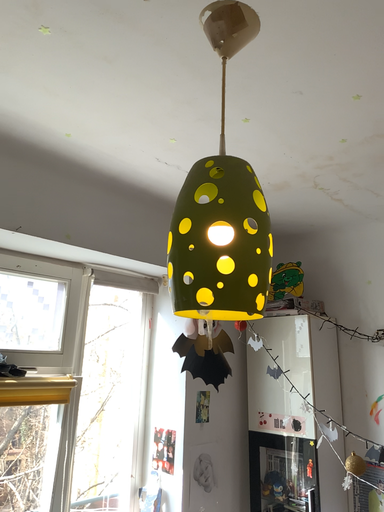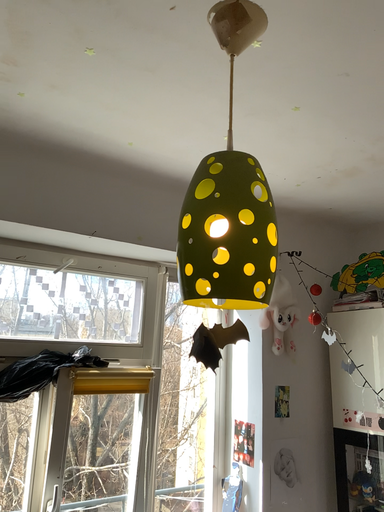
Question: Which way did the camera rotate in the video?

Choices:
 (A) rotated left
 (B) rotated right

Answer: (A)